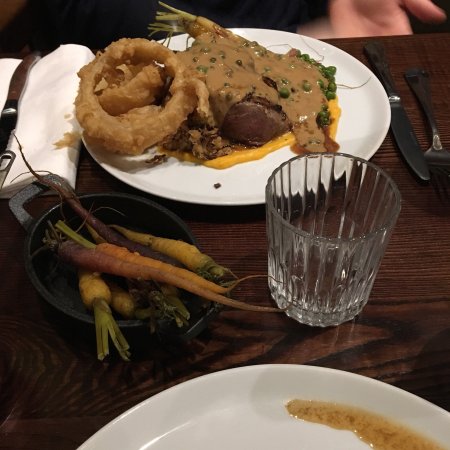
Locate an element on the screen. table is located at coordinates (431, 279).